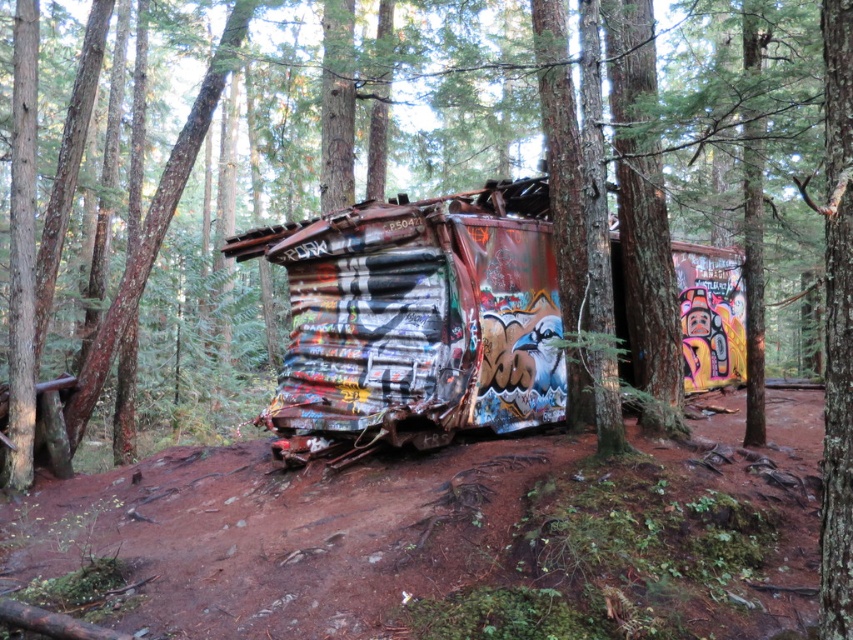
Is the position of brown dirt track at center more distant than that of rusty corrugated metal train car at center?

That is False.

Is brown dirt track at center closer to camera compared to rusty corrugated metal train car at center?

Yes.

Is point (82, 516) closer to viewer compared to point (334, 385)?

Yes, it is.

Find the location of a particular element. The image size is (853, 640). brown dirt track at center is located at coordinates (445, 538).